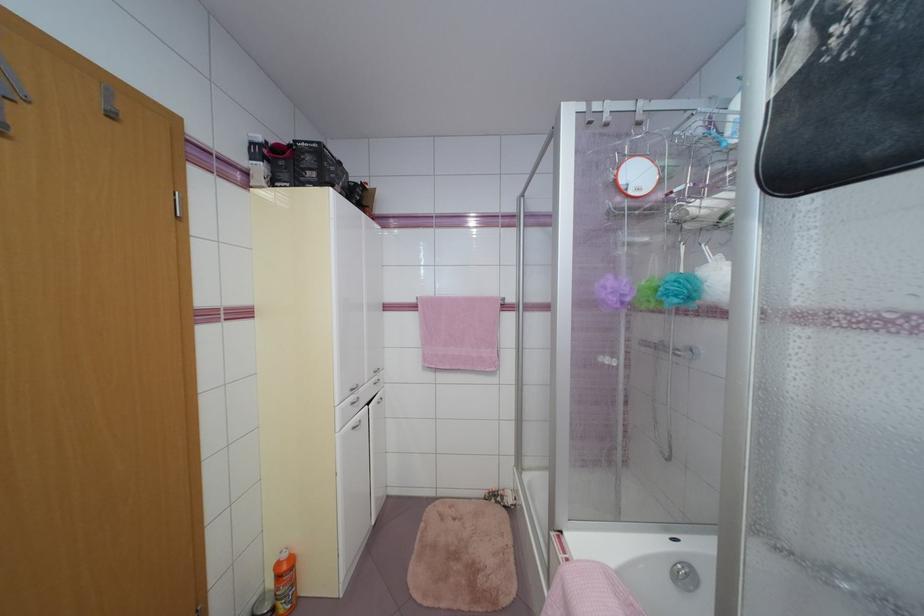
Find where to squeez the purple loofah. Please return your answer as a coordinate pair (x, y).

(458, 331)